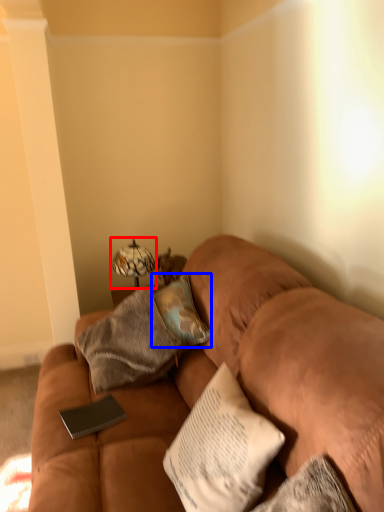
Question: Which of the following is the closest to the observer, table lamp (highlighted by a red box) or pillow (highlighted by a blue box)?

Choices:
 (A) table lamp
 (B) pillow

Answer: (B)